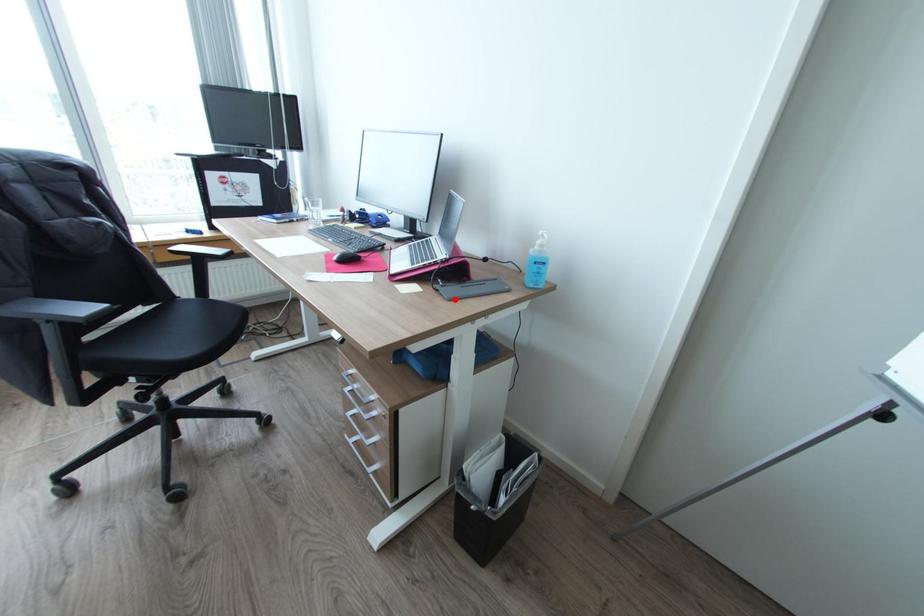
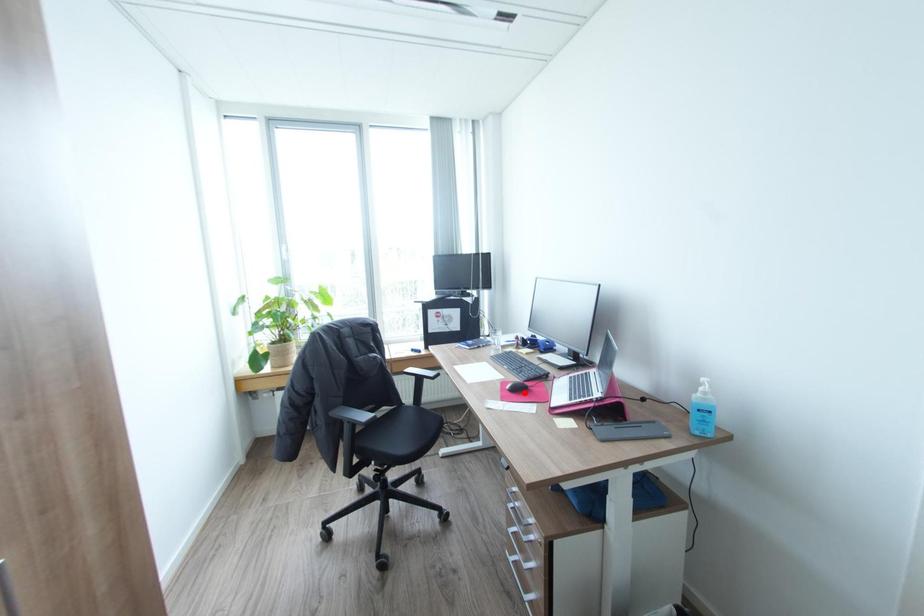
I am providing you with two images of the same scene from different viewpoints. A red point is marked on the first image and another point is marked on the second image. Is the red point in image1 aligned with the point shown in image2?

No